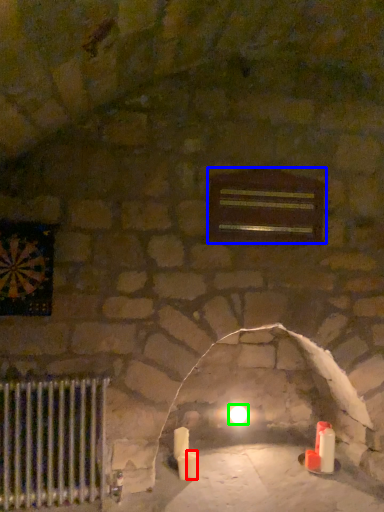
Question: Based on their relative distances, which object is nearer to candle (highlighted by a red box)? Choose from window (highlighted by a blue box) and glow (highlighted by a green box).

Choices:
 (A) window
 (B) glow

Answer: (B)